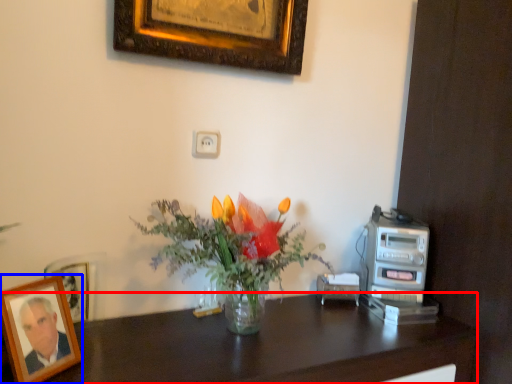
Question: Which object is closer to the camera taking this photo, desk (highlighted by a red box) or picture frame (highlighted by a blue box)?

Choices:
 (A) desk
 (B) picture frame

Answer: (A)